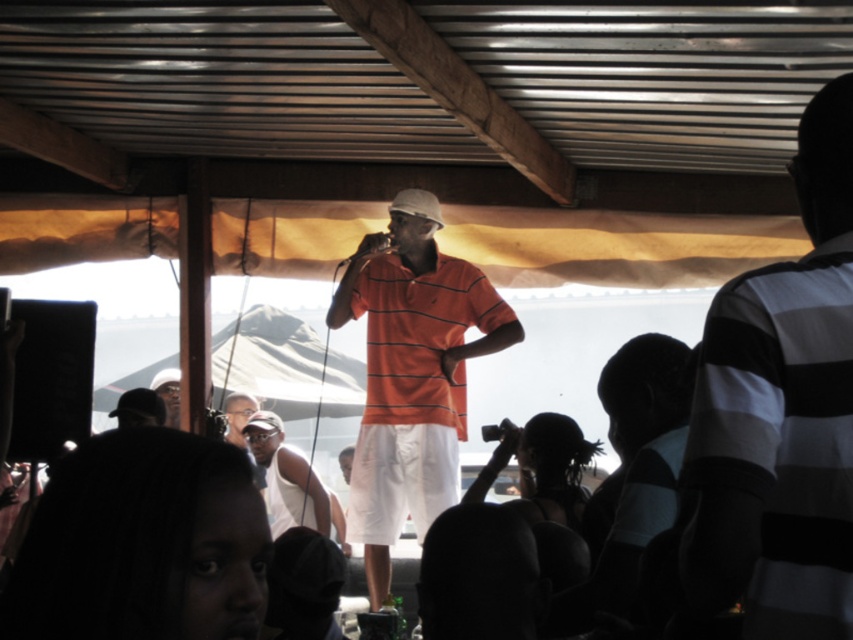
Question: Can you confirm if orange striped polo shirt at center is thinner than white tank top at center?

Choices:
 (A) yes
 (B) no

Answer: (B)

Question: Which point is farther to the camera?

Choices:
 (A) orange striped shirt at center
 (B) matte black cap at upper center
 (C) orange striped polo shirt at center

Answer: (B)

Question: Which object appears farthest from the camera in this image?

Choices:
 (A) white tank top at center
 (B) striped cotton shirt at right
 (C) orange striped shirt at center

Answer: (A)

Question: Is orange striped shirt at center below orange striped polo shirt at center?

Choices:
 (A) no
 (B) yes

Answer: (B)

Question: Among these points, which one is nearest to the camera?

Choices:
 (A) (258, 428)
 (B) (431, 372)
 (C) (178, 406)
 (D) (424, 296)

Answer: (B)

Question: Is orange striped shirt at center bigger than matte black cap at upper center?

Choices:
 (A) yes
 (B) no

Answer: (A)